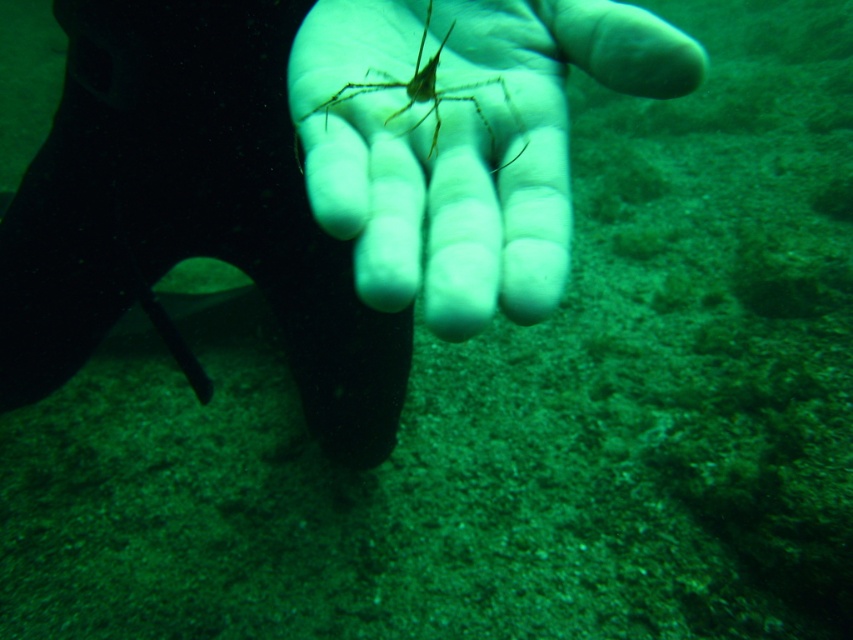
Question: Which is nearer to the translucent yellowish-green hand at center?

Choices:
 (A) translucent yellowish spider at center
 (B) translucent rubber hand at center

Answer: (A)

Question: Among these objects, which one is farthest from the camera?

Choices:
 (A) translucent yellowish spider at center
 (B) translucent rubber hand at center
 (C) translucent yellowish-green hand at center

Answer: (B)

Question: Can you confirm if translucent rubber hand at center is positioned to the right of translucent yellowish spider at center?

Choices:
 (A) no
 (B) yes

Answer: (A)

Question: Considering the real-world distances, which object is closest to the translucent yellowish-green hand at center?

Choices:
 (A) translucent rubber hand at center
 (B) translucent yellowish spider at center

Answer: (B)

Question: Does translucent rubber hand at center appear under translucent yellowish-green hand at center?

Choices:
 (A) yes
 (B) no

Answer: (A)

Question: Is translucent rubber hand at center wider than translucent yellowish spider at center?

Choices:
 (A) no
 (B) yes

Answer: (B)